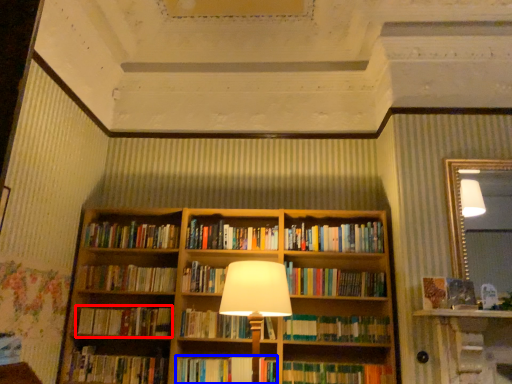
Question: Which object is further to the camera taking this photo, book (highlighted by a red box) or book (highlighted by a blue box)?

Choices:
 (A) book
 (B) book

Answer: (A)